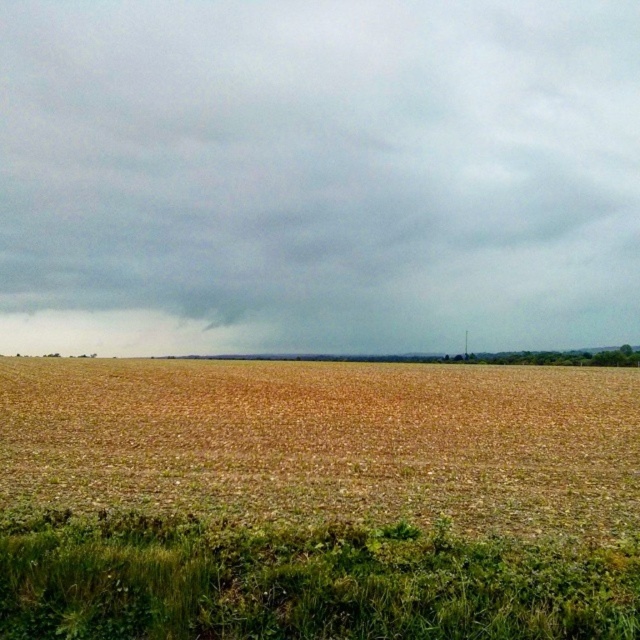
You are a farmer assessing the weather conditions for irrigation. You observe the gray cloudy sky at upper center and the brown dry grass at center. Which object occupies a larger area in the image?

The gray cloudy sky at upper center occupies a larger area in the image than the brown dry grass at center, as its width is greater according to the description.

You are a farmer assessing the weather conditions for irrigation. You notice the gray cloudy sky at upper center and brown dry grass at center. Based on the scene, which object is positioned higher in the image?

The gray cloudy sky at upper center is positioned higher in the image than the brown dry grass at center.

You are standing in the middle of the agricultural field and want to take a photo of the gray cloudy sky at upper center and the brown dry grass at center. Which object will appear closer to you in the photo?

The gray cloudy sky at upper center will appear closer to you in the photo because it is further to the viewer than the brown dry grass at center.